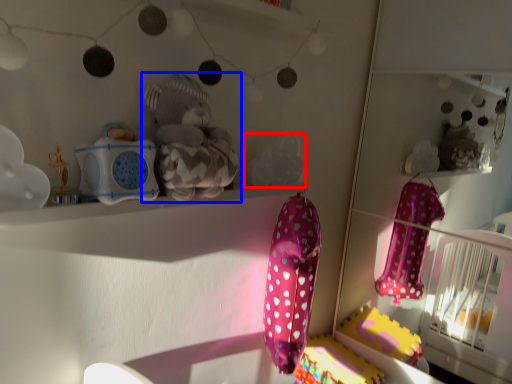
Question: Which object is closer to the camera taking this photo, toy (highlighted by a red box) or toy (highlighted by a blue box)?

Choices:
 (A) toy
 (B) toy

Answer: (B)